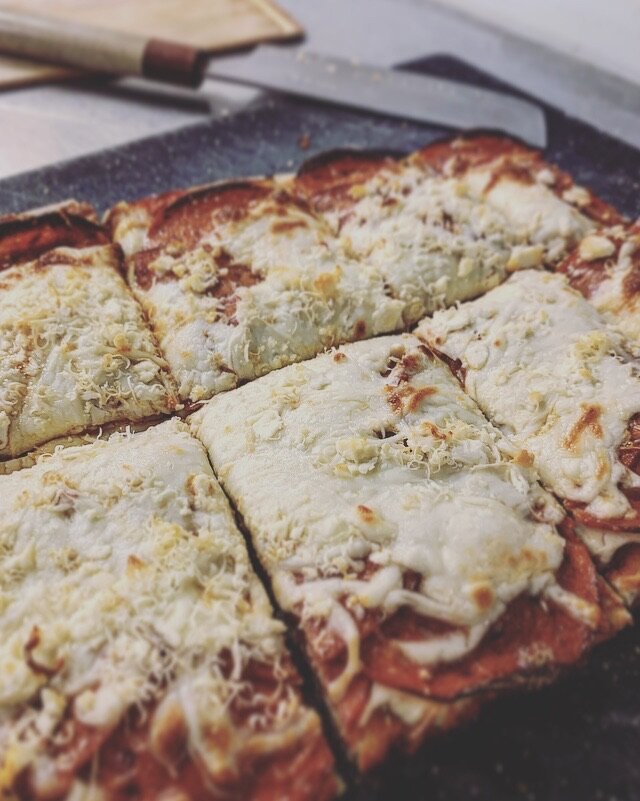
Image resolution: width=640 pixels, height=801 pixels. Find the location of `wooden cutting board`. wooden cutting board is located at coordinates (237, 14).